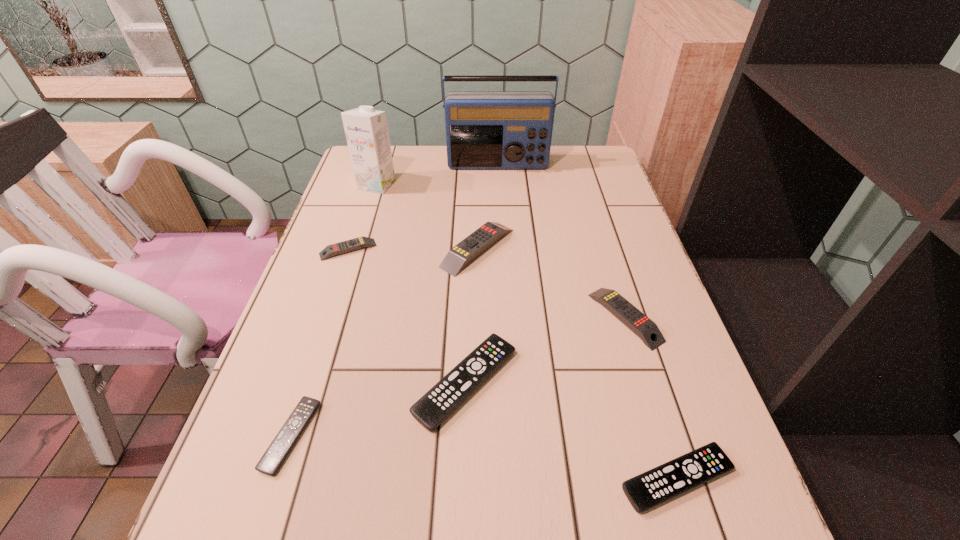
I want to click on free location located 0.260m on the back of the smallest black remote control, so pyautogui.click(x=335, y=299).

What are the coordinates of `radio receiver at the far edge` in the screenshot? It's located at (484, 129).

At what (x,y) coordinates should I click in order to perform the action: click on carton at the far edge. Please return your answer as a coordinate pair (x, y). Looking at the image, I should click on (366, 130).

This screenshot has height=540, width=960. I want to click on carton present at the left edge, so click(366, 130).

At what (x,y) coordinates should I click in order to perform the action: click on object that is at the far left corner. Please return your answer as a coordinate pair (x, y). Looking at the image, I should click on (366, 130).

Locate an element on the screen. vacant space at the far edge is located at coordinates (481, 171).

You are a GUI agent. You are given a task and a screenshot of the screen. Output one action in this format:
    pyautogui.click(x=<x>, y=<y>)
    Task: Click on the vacant area at the near edge of the desktop
    This screenshot has width=960, height=540.
    Given the screenshot: What is the action you would take?
    pyautogui.click(x=474, y=530)

The image size is (960, 540). In the image, there is a desktop. In order to click on free space at the left edge in this screenshot , I will do `click(337, 261)`.

At what (x,y) coordinates should I click in order to perform the action: click on free location at the right edge of the desktop. Please return your answer as a coordinate pair (x, y). The width and height of the screenshot is (960, 540). Looking at the image, I should click on (600, 197).

In the image, there is a desktop. Where is `vacant space at the far left corner`? This screenshot has height=540, width=960. vacant space at the far left corner is located at coordinates (348, 173).